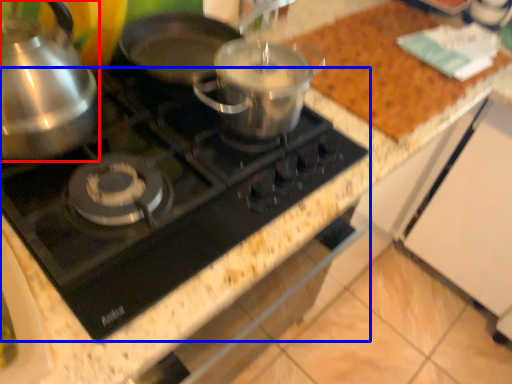
Question: Which of the following is the farthest to the observer, kitchen appliance (highlighted by a red box) or gas stove (highlighted by a blue box)?

Choices:
 (A) kitchen appliance
 (B) gas stove

Answer: (B)